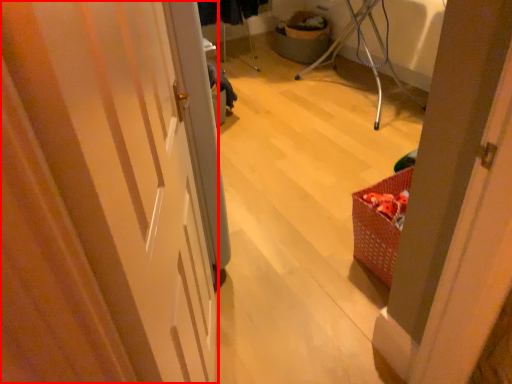
Question: From the image's perspective, considering the relative positions of door (annotated by the red box) and basket in the image provided, where is door (annotated by the red box) located with respect to the staircase?

Choices:
 (A) below
 (B) above

Answer: (A)